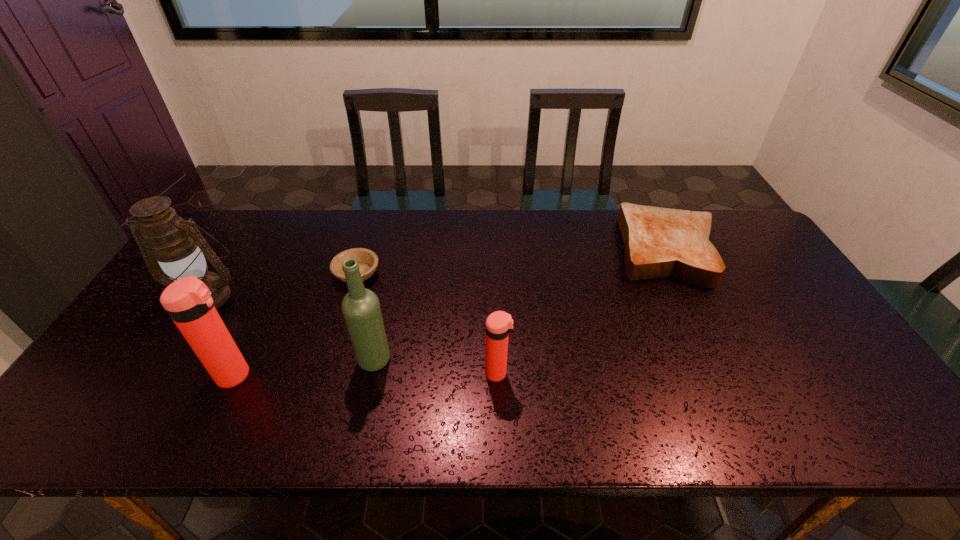
Where is `the fifth object from right to left`? The height and width of the screenshot is (540, 960). the fifth object from right to left is located at coordinates (188, 301).

Locate an element on the screen. the left thermos bottle is located at coordinates (188, 301).

Where is `the fourth tallest object`? This screenshot has width=960, height=540. the fourth tallest object is located at coordinates (499, 324).

Locate an element on the screen. The width and height of the screenshot is (960, 540). the right thermos bottle is located at coordinates (499, 324).

This screenshot has height=540, width=960. I want to click on the fifth tallest object, so click(659, 242).

This screenshot has height=540, width=960. I want to click on the rightmost object, so click(x=659, y=242).

In order to click on bowl in this screenshot , I will do `click(368, 261)`.

Find the location of a particular element. This screenshot has width=960, height=540. wine bottle is located at coordinates (361, 309).

Image resolution: width=960 pixels, height=540 pixels. I want to click on oil lamp, so click(177, 245).

Image resolution: width=960 pixels, height=540 pixels. In order to click on vacant space located on the left of the left thermos bottle in this screenshot , I will do pyautogui.click(x=121, y=375).